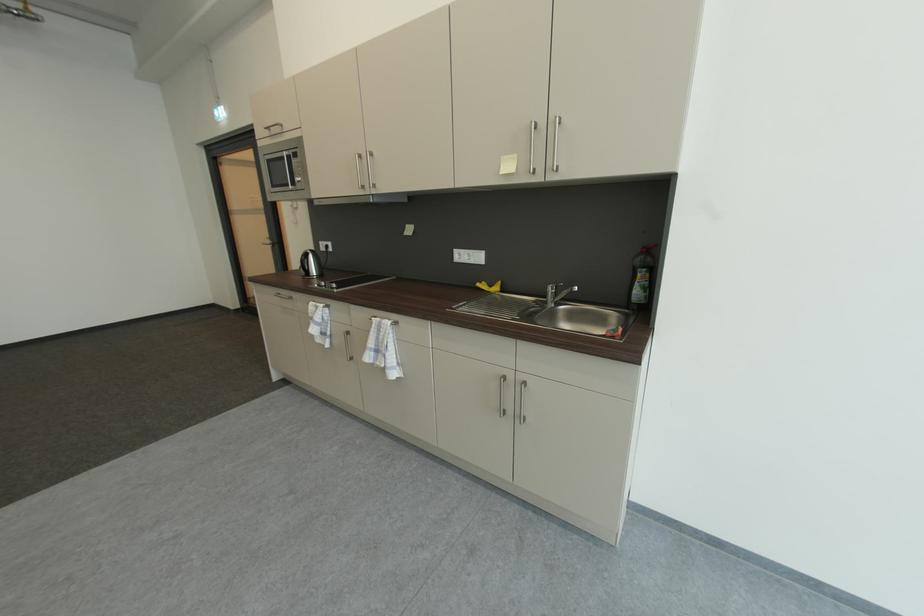
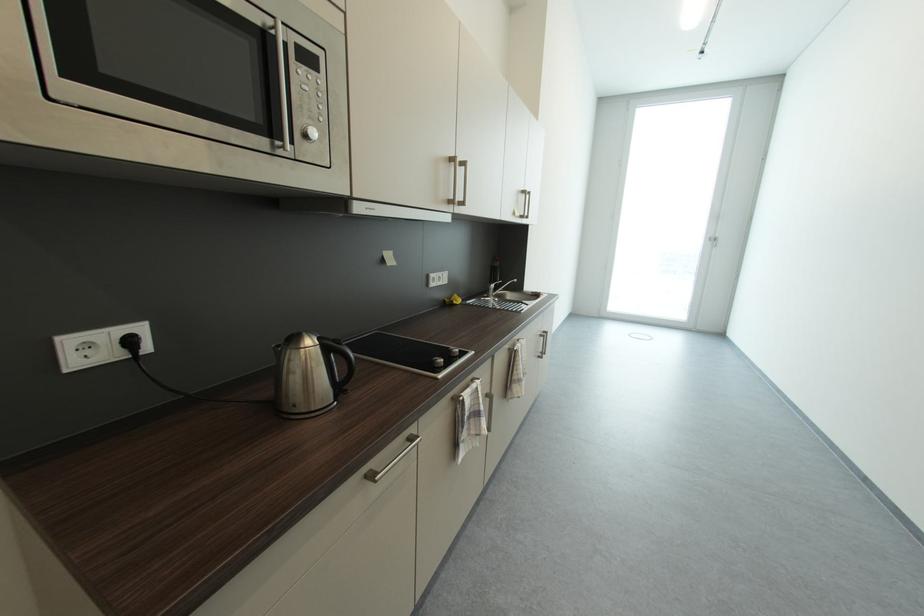
The point at (334, 248) is marked in the first image. Where is the corresponding point in the second image?

(137, 344)